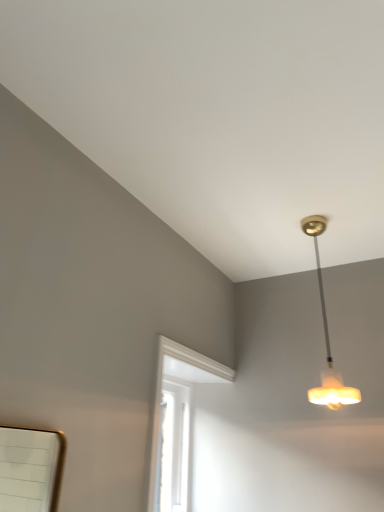
Question: From the image's perspective, is translucent glass pendant light at upper right above or below white painted wood window at center?

Choices:
 (A) above
 (B) below

Answer: (A)

Question: From a real-world perspective, is translucent glass pendant light at upper right physically located above or below white painted wood window at center?

Choices:
 (A) above
 (B) below

Answer: (A)

Question: Is translucent glass pendant light at upper right to the left or to the right of white painted wood window at center in the image?

Choices:
 (A) right
 (B) left

Answer: (A)

Question: Would you say white painted wood window at center is to the left or to the right of translucent glass pendant light at upper right in the picture?

Choices:
 (A) left
 (B) right

Answer: (A)

Question: In terms of width, does white painted wood window at center look wider or thinner when compared to translucent glass pendant light at upper right?

Choices:
 (A) thin
 (B) wide

Answer: (A)

Question: Is white painted wood window at center in front of or behind translucent glass pendant light at upper right in the image?

Choices:
 (A) front
 (B) behind

Answer: (A)

Question: Considering the positions of white painted wood window at center and translucent glass pendant light at upper right in the image, is white painted wood window at center taller or shorter than translucent glass pendant light at upper right?

Choices:
 (A) short
 (B) tall

Answer: (A)